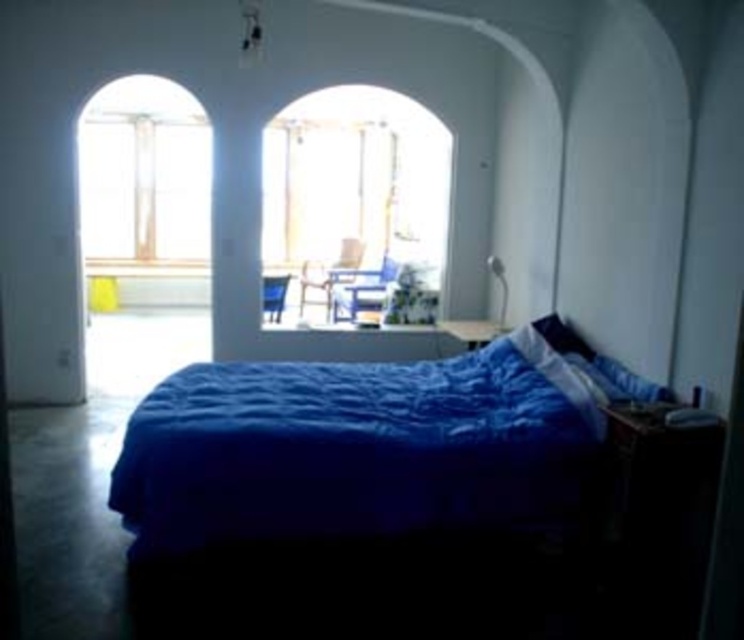
Question: Does blue quilted bed at center have a larger size compared to clear glass window at upper left?

Choices:
 (A) yes
 (B) no

Answer: (B)

Question: Based on their relative distances, which object is nearer to the wooden chair at center?

Choices:
 (A) matte blue chair at center
 (B) metallic blue chair at center
 (C) clear glass window at center

Answer: (A)

Question: Does clear glass window at center have a greater width compared to wooden chair at center?

Choices:
 (A) no
 (B) yes

Answer: (B)

Question: Can you confirm if clear glass window at center is positioned below clear glass window at upper left?

Choices:
 (A) no
 (B) yes

Answer: (B)

Question: Among these points, which one is nearest to the camera?

Choices:
 (A) (426, 316)
 (B) (263, 285)

Answer: (A)

Question: Which point is farther to the camera?

Choices:
 (A) (333, 310)
 (B) (298, 253)
 (C) (356, 268)

Answer: (B)